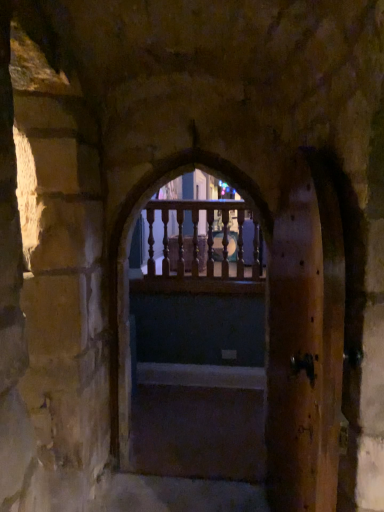
Question: Considering their positions, is wooden railing at center located in front of or behind dark wood stairs at center?

Choices:
 (A) behind
 (B) front

Answer: (B)

Question: Would you say wooden railing at center is inside or outside dark wood stairs at center?

Choices:
 (A) outside
 (B) inside

Answer: (A)

Question: Based on their relative distances, which object is farther from the transparent wooden railing at center?

Choices:
 (A) wooden railing at center
 (B) brown wooden screen door at right
 (C) dark wood stairs at center

Answer: (B)

Question: Which of these objects is positioned farthest from the brown wooden screen door at right?

Choices:
 (A) wooden railing at center
 (B) transparent wooden railing at center
 (C) dark wood stairs at center

Answer: (B)